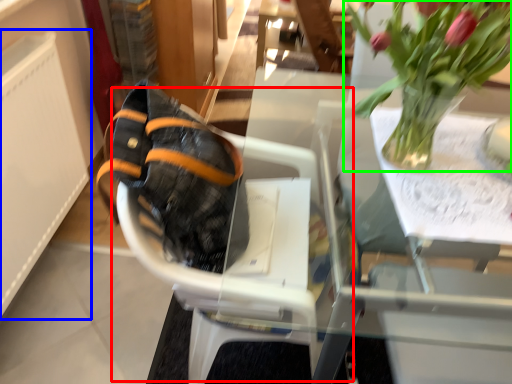
Question: Based on their relative distances, which object is farther from baby carriage (highlighted by a red box)? Choose from radiator (highlighted by a blue box) and houseplant (highlighted by a green box).

Choices:
 (A) radiator
 (B) houseplant

Answer: (A)